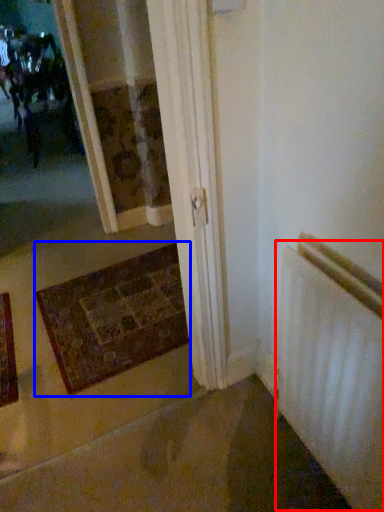
Question: Among these objects, which one is farthest to the camera, radiator (highlighted by a red box) or mat (highlighted by a blue box)?

Choices:
 (A) radiator
 (B) mat

Answer: (B)